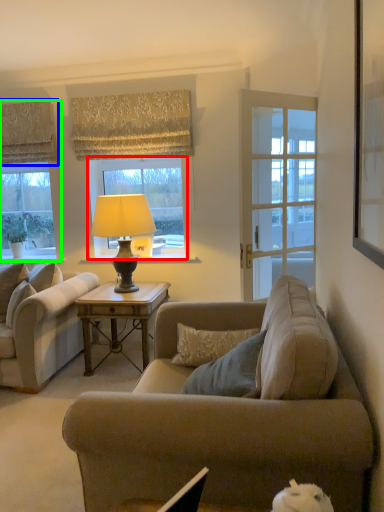
Question: Which object is the closest to the window (highlighted by a red box)? Choose among these: curtain (highlighted by a blue box) or window (highlighted by a green box).

Choices:
 (A) curtain
 (B) window

Answer: (A)